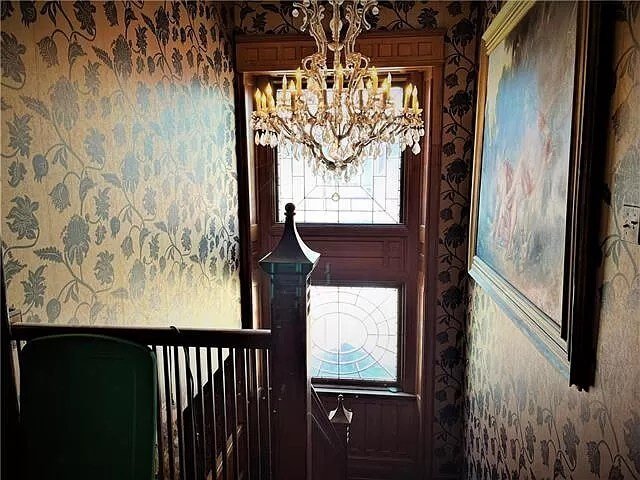
Locate an element on the screen. The image size is (640, 480). vertical wood frame is located at coordinates (429, 252), (264, 234).